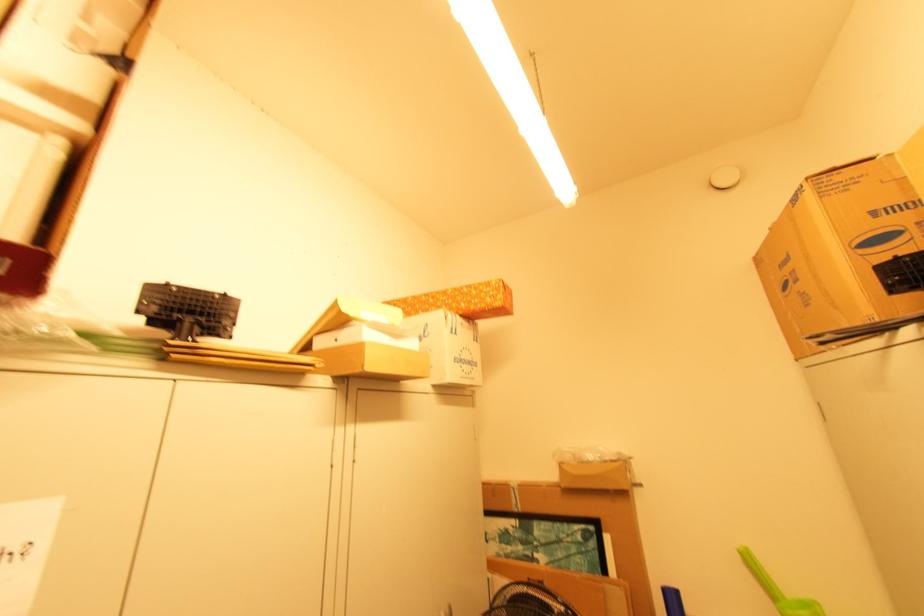
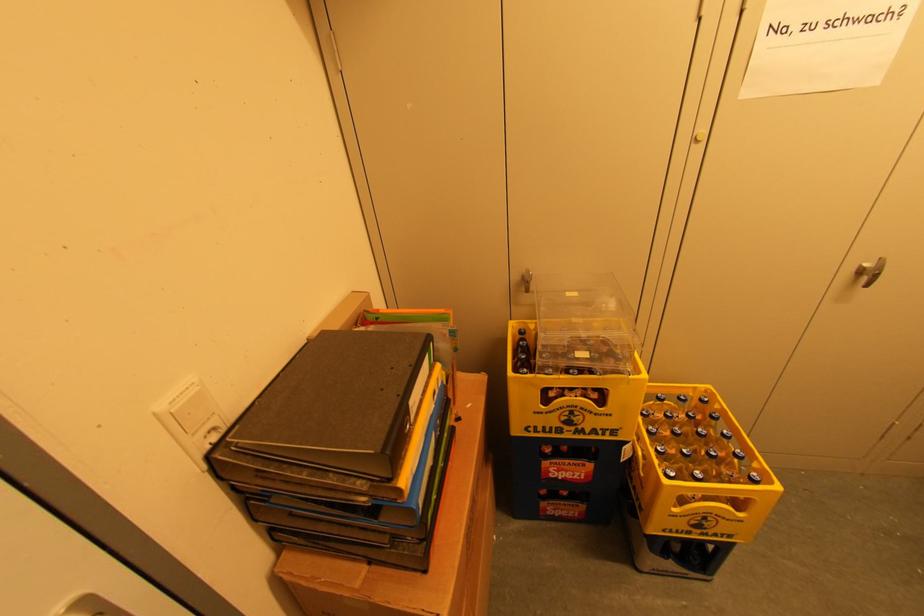
The first image is from the beginning of the video and the second image is from the end. How did the camera likely rotate when shooting the video?

The camera's rotation is toward left-down.